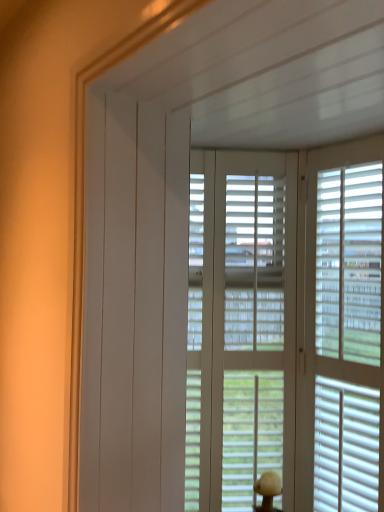
What is the approximate width of white matte window blind at center?

The width of white matte window blind at center is 7.35 centimeters.

Locate an element on the screen. white matte window blind at center is located at coordinates (286, 327).

This screenshot has width=384, height=512. What do you see at coordinates (286, 327) in the screenshot?
I see `white matte window blind at center` at bounding box center [286, 327].

The image size is (384, 512). What do you see at coordinates (348, 338) in the screenshot?
I see `white matte blinds at right` at bounding box center [348, 338].

I want to click on white matte blinds at right, so click(x=348, y=338).

Measure the distance between point (327, 257) and camera.

Point (327, 257) and camera are 1.44 meters apart.

Where is `white matte window blind at center`? white matte window blind at center is located at coordinates (286, 327).

In the scene shown: Between white matte window blind at center and white matte blinds at right, which one appears on the left side from the viewer's perspective?

Result: From the viewer's perspective, white matte window blind at center appears more on the left side.

Is the depth of white matte window blind at center greater than that of white matte blinds at right?

That is True.

Is point (269, 291) less distant than point (316, 223)?

No.

From the image's perspective, would you say white matte window blind at center is shown under white matte blinds at right?

Indeed, from the image's perspective, white matte window blind at center is shown beneath white matte blinds at right.

From a real-world perspective, is white matte window blind at center under white matte blinds at right?

Yes, from a real-world perspective, white matte window blind at center is under white matte blinds at right.

Does white matte window blind at center have a greater width compared to white matte blinds at right?

Yes, white matte window blind at center is wider than white matte blinds at right.

Between white matte window blind at center and white matte blinds at right, which one has more height?

white matte window blind at center.

Which of these two, white matte window blind at center or white matte blinds at right, is smaller?

Smaller between the two is white matte blinds at right.

Is white matte blinds at right completely or partially inside white matte window blind at center?

No, white matte blinds at right is located outside of white matte window blind at center.

Is there a large distance between white matte window blind at center and white matte blinds at right?

That's not correct — white matte window blind at center is a little close to white matte blinds at right.

Is white matte window blind at center positioned with its back to white matte blinds at right?

No, white matte window blind at center is not facing away from white matte blinds at right.

I want to click on blind that is in front of the white matte window blind at center, so click(348, 338).

Is white matte blinds at right to the right of white matte window blind at center from the viewer's perspective?

Correct, you'll find white matte blinds at right to the right of white matte window blind at center.

Looking at this image, which object is more forward, white matte blinds at right or white matte window blind at center?

white matte blinds at right.

Does point (318, 246) come in front of point (358, 337)?

No.

From the image's perspective, is white matte blinds at right above or below white matte window blind at center?

white matte blinds at right is above white matte window blind at center.

Consider the image. From a real-world perspective, between white matte blinds at right and white matte window blind at center, who is vertically lower?

In real-world perspective, white matte window blind at center is lower.

Is white matte blinds at right wider than white matte window blind at center?

Incorrect, the width of white matte blinds at right does not surpass that of white matte window blind at center.

From their relative heights in the image, would you say white matte blinds at right is taller or shorter than white matte window blind at center?

In the image, white matte blinds at right appears to be shorter than white matte window blind at center.

Which of these two, white matte blinds at right or white matte window blind at center, is smaller?

white matte blinds at right.

Is white matte blinds at right located outside white matte window blind at center?

Absolutely, white matte blinds at right is external to white matte window blind at center.

Are white matte blinds at right and white matte window blind at center far apart?

white matte blinds at right is actually quite close to white matte window blind at center.

Is white matte blinds at right oriented away from white matte window blind at center?

No, white matte window blind at center is not at the back of white matte blinds at right.

Measure the distance between white matte blinds at right and white matte window blind at center.

The distance of white matte blinds at right from white matte window blind at center is 2.91 inches.

The height and width of the screenshot is (512, 384). In order to click on blind above the white matte window blind at center (from a real-world perspective) in this screenshot , I will do `click(348, 338)`.

At what (x,y) coordinates should I click in order to perform the action: click on window blind behind the white matte blinds at right. Please return your answer as a coordinate pair (x, y). The width and height of the screenshot is (384, 512). Looking at the image, I should click on (286, 327).

Where is `window blind that appears below the white matte blinds at right (from a real-world perspective)`? window blind that appears below the white matte blinds at right (from a real-world perspective) is located at coordinates (286, 327).